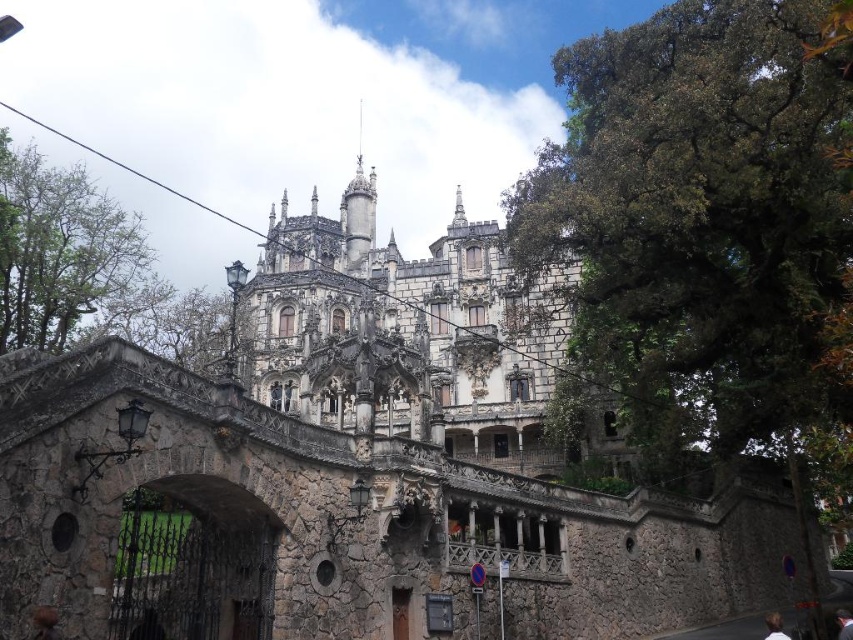
You are standing at the entrance of the grand building and looking towards the stone bridge. There is a person with white hair at lower right in the scene. Where exactly is the white hair located in terms of coordinates?

The white hair at lower right is located at the 2D coordinates of point (775,627).

You are a visitor approaching the grand building and notice two people in the scene. One has white hair at lower right and the other has brown hair at upper center. Which person is standing closer to the left side of the scene?

The white hair at lower right is positioned on the left side of brown hair at upper center, so the person with white hair at lower right is closer to the left side of the scene.

You are a photographer standing at the base of the stone bridge, aiming to capture the entire building and both individuals with their distinct hair colors in one frame. Based on their positions, which person with white hair at lower right or brown hair at upper center would appear larger in the photo?

The white hair at lower right would appear larger in the photo because it is closer to the camera, making it appear wider than the brown hair at upper center.